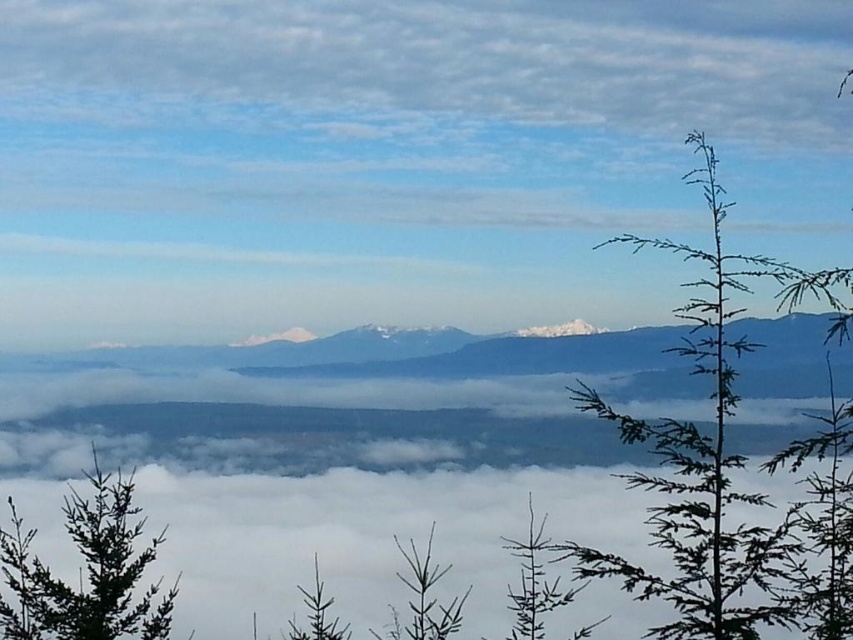
You are an observer standing in front of the landscape. You notice the green matte tree at lower left and the green matte tree at center. Which tree appears taller?

The green matte tree at lower left is taller than the green matte tree at center.

You are standing at the point marked as point (86, 572) in the image. What object is exactly at this location?

The green matte tree at lower left is exactly at point (86, 572).